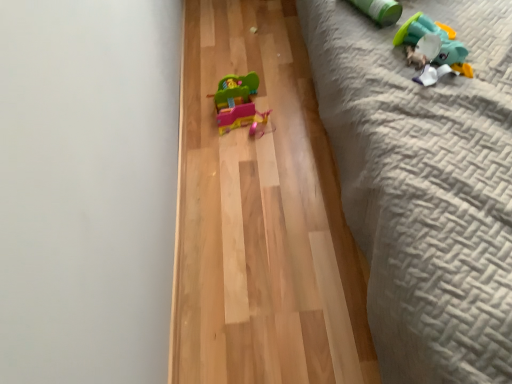
This screenshot has height=384, width=512. I want to click on vacant area situated below matte plastic toy at center, acting as the first toy starting from the left (from a real-world perspective), so click(x=245, y=114).